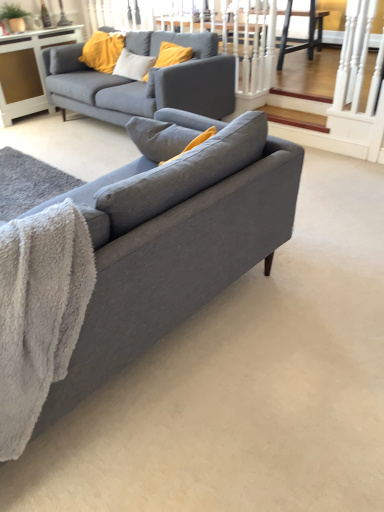
Question: In which direction should I rotate to look at matte gray couch at center, which appears as the 2th studio couch when ordered from the bottom?

Choices:
 (A) left
 (B) right

Answer: (A)

Question: Is matte gray couch at center, arranged as the first studio couch when ordered from the bottom, inside white glossy cabinet at upper left?

Choices:
 (A) no
 (B) yes

Answer: (A)

Question: Is white glossy cabinet at upper left positioned before matte gray couch at center, which is the second studio couch in top-to-bottom order?

Choices:
 (A) no
 (B) yes

Answer: (A)

Question: From a real-world perspective, is white glossy cabinet at upper left positioned under matte gray couch at center, which is the second studio couch in top-to-bottom order, based on gravity?

Choices:
 (A) yes
 (B) no

Answer: (A)

Question: Is white glossy cabinet at upper left shorter than matte gray couch at center, the first studio couch in the front-to-back sequence?

Choices:
 (A) no
 (B) yes

Answer: (B)

Question: Considering the relative sizes of white glossy cabinet at upper left and matte gray couch at center, arranged as the first studio couch when ordered from the bottom, in the image provided, is white glossy cabinet at upper left taller than matte gray couch at center, arranged as the first studio couch when ordered from the bottom,?

Choices:
 (A) no
 (B) yes

Answer: (A)

Question: Is white glossy cabinet at upper left further to camera compared to matte gray couch at center, the first studio couch in the front-to-back sequence?

Choices:
 (A) yes
 (B) no

Answer: (A)

Question: Does gray fluffy blanket at lower left appear on the left side of matte gray couch at center, the first studio couch from the top?

Choices:
 (A) yes
 (B) no

Answer: (A)

Question: Is gray fluffy blanket at lower left thinner than matte gray couch at center, the 1th studio couch when ordered from back to front?

Choices:
 (A) yes
 (B) no

Answer: (A)

Question: Is gray fluffy blanket at lower left at the right side of matte gray couch at center, which is counted as the 2th studio couch, starting from the front?

Choices:
 (A) no
 (B) yes

Answer: (A)

Question: Is gray fluffy blanket at lower left directly adjacent to matte gray couch at center, which is counted as the 2th studio couch, starting from the front?

Choices:
 (A) no
 (B) yes

Answer: (A)

Question: Considering the relative sizes of gray fluffy blanket at lower left and matte gray couch at center, the first studio couch from the top, in the image provided, is gray fluffy blanket at lower left wider than matte gray couch at center, the first studio couch from the top,?

Choices:
 (A) yes
 (B) no

Answer: (B)

Question: Considering the relative sizes of gray fluffy blanket at lower left and matte gray couch at center, which is counted as the 2th studio couch, starting from the front, in the image provided, is gray fluffy blanket at lower left shorter than matte gray couch at center, which is counted as the 2th studio couch, starting from the front,?

Choices:
 (A) no
 (B) yes

Answer: (B)

Question: Is matte gray couch at center, the 1th studio couch when ordered from back to front, shorter than white glossy cabinet at upper left?

Choices:
 (A) no
 (B) yes

Answer: (A)